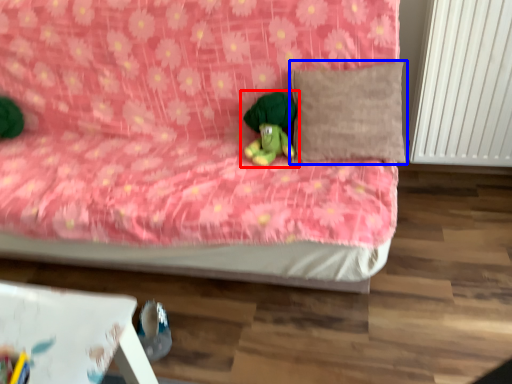
Question: Which object appears closest to the camera in this image, toy (highlighted by a red box) or pillow (highlighted by a blue box)?

Choices:
 (A) toy
 (B) pillow

Answer: (B)